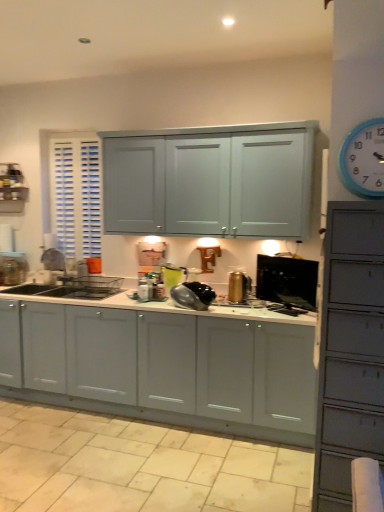
Question: In terms of width, does metallic silver toaster at center, the fourth appliance in the right-to-left sequence, look wider or thinner when compared to black glossy monitor at center, which is the 1th appliance from right to left?

Choices:
 (A) thin
 (B) wide

Answer: (B)

Question: Is metallic silver toaster at center, which is the 1th appliance in left-to-right order, to the left or to the right of black glossy monitor at center, which is the 1th appliance from right to left, in the image?

Choices:
 (A) right
 (B) left

Answer: (B)

Question: Estimate the real-world distances between objects in this image. Which object is farther from the metallic silver toaster at center, which is the 1th appliance in left-to-right order?

Choices:
 (A) gold metallic kettle at center, positioned as the third appliance in left-to-right order
 (B) beige tile at lower center
 (C) matte white cabinets at center
 (D) shiny metallic kettle at center, the second appliance viewed from the left
 (E) blue plastic clock at upper right

Answer: (E)

Question: Considering the real-world distances, which object is farthest from the metallic silver toaster at center, the fourth appliance in the right-to-left sequence?

Choices:
 (A) shiny metallic kettle at center, the second appliance viewed from the left
 (B) matte white cabinets at center
 (C) gold metallic kettle at center, the second appliance positioned from the right
 (D) blue plastic clock at upper right
 (E) beige tile at lower center

Answer: (D)